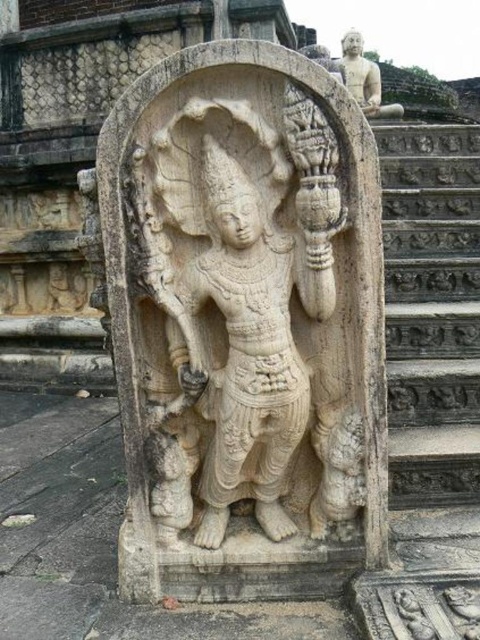
Measure the distance between white stone statue at center and camera.

A distance of 6.57 feet exists between white stone statue at center and camera.

Does point (263, 266) come closer to viewer compared to point (476, 208)?

That is True.

Locate an element on the screen. This screenshot has width=480, height=640. white stone statue at center is located at coordinates (244, 324).